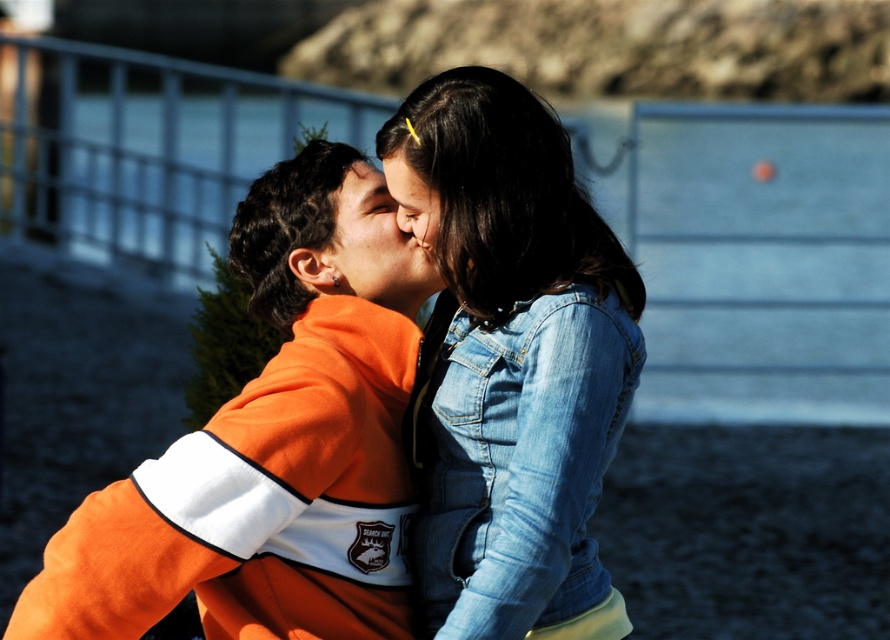
Question: Does matte orange sweatshirt at center come behind matte denim jacket at center?

Choices:
 (A) no
 (B) yes

Answer: (B)

Question: Which point is closer to the camera?

Choices:
 (A) denim jacket at upper center
 (B) matte orange sweatshirt at center

Answer: (A)

Question: Can you confirm if faded denim jacket at lower right is bigger than matte orange sweatshirt at center?

Choices:
 (A) no
 (B) yes

Answer: (B)

Question: Among these objects, which one is nearest to the camera?

Choices:
 (A) matte denim jacket at center
 (B) faded denim jacket at lower right
 (C) denim jacket at upper center

Answer: (B)

Question: Estimate the real-world distances between objects in this image. Which object is closer to the denim jacket at upper center?

Choices:
 (A) matte orange sweatshirt at center
 (B) faded denim jacket at lower right

Answer: (A)

Question: Observing the image, what is the correct spatial positioning of denim jacket at upper center in reference to matte orange sweatshirt at center?

Choices:
 (A) left
 (B) right

Answer: (A)